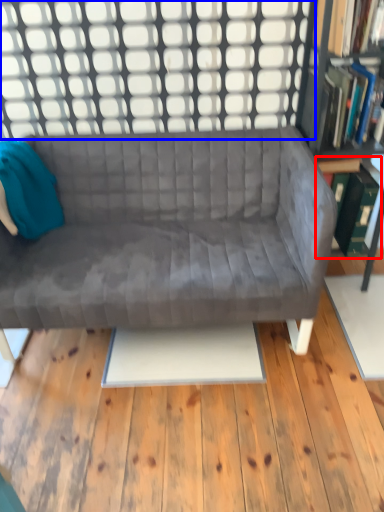
Question: Among these objects, which one is farthest to the camera, shelf (highlighted by a red box) or window (highlighted by a blue box)?

Choices:
 (A) shelf
 (B) window

Answer: (A)